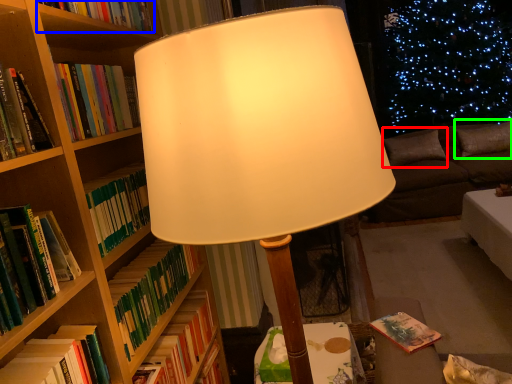
Question: Which object is the closest to the pillow (highlighted by a red box)? Choose among these: book (highlighted by a blue box) or pillow (highlighted by a green box).

Choices:
 (A) book
 (B) pillow

Answer: (B)